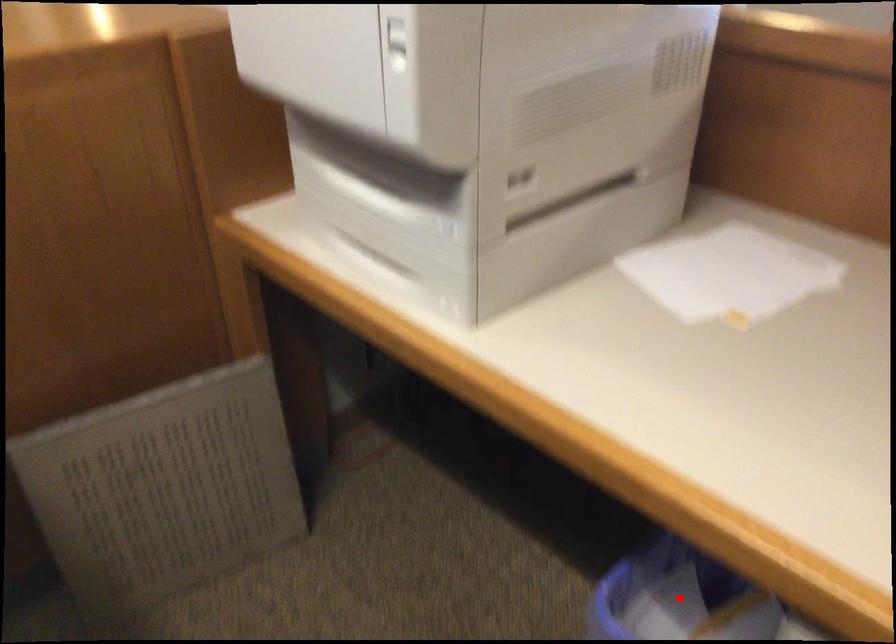
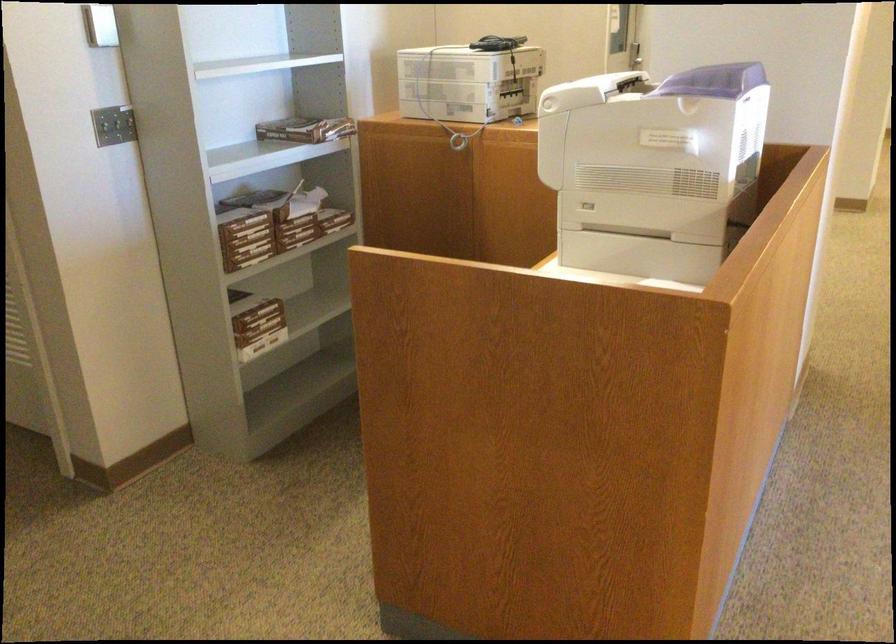
Question: I am providing you with two images of the same scene from different viewpoints. A red point is marked on the first image. At the location where the point appears in image 1, is it still visible in image 2?

Choices:
 (A) Yes
 (B) No

Answer: (B)